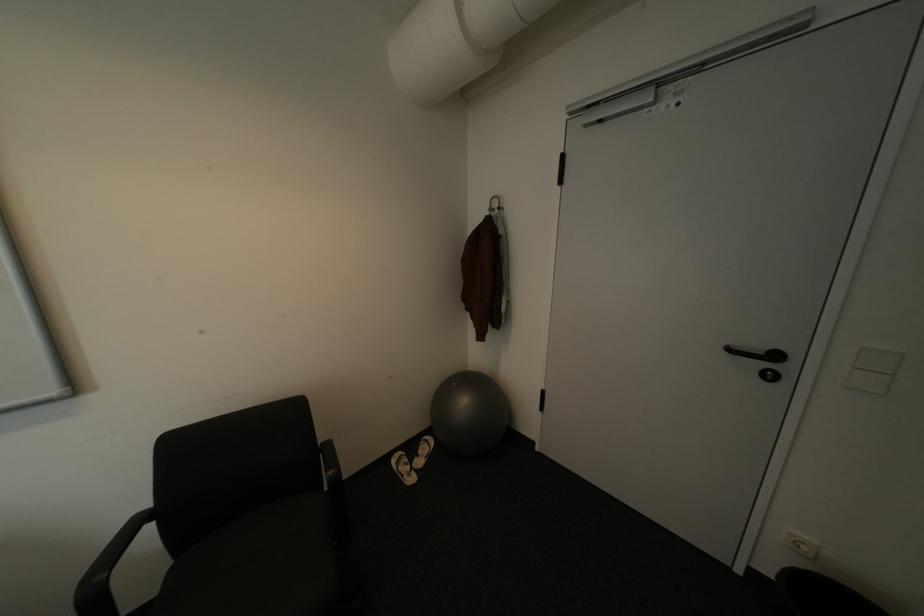
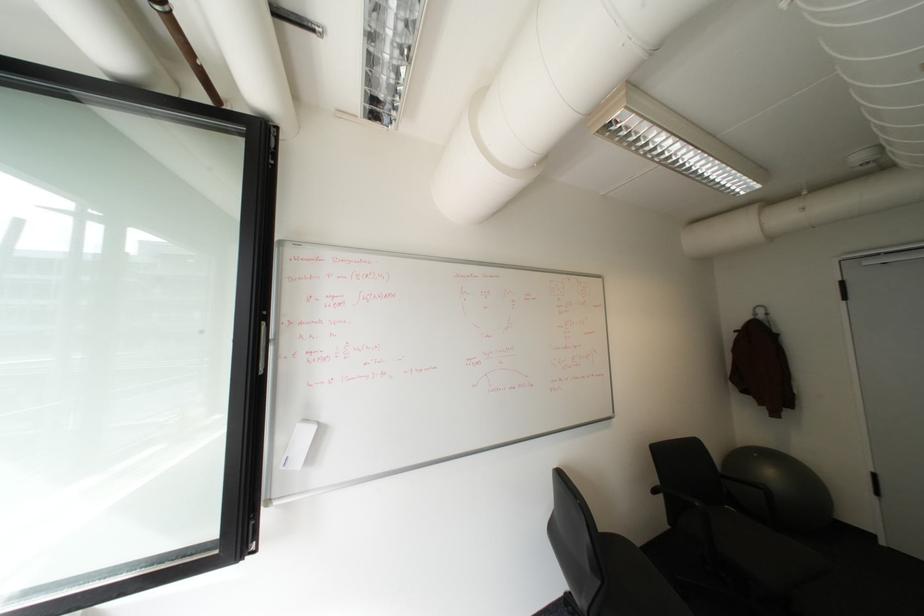
What movement of the cameraman would produce the second image?

The cameraman moved toward left, backward.